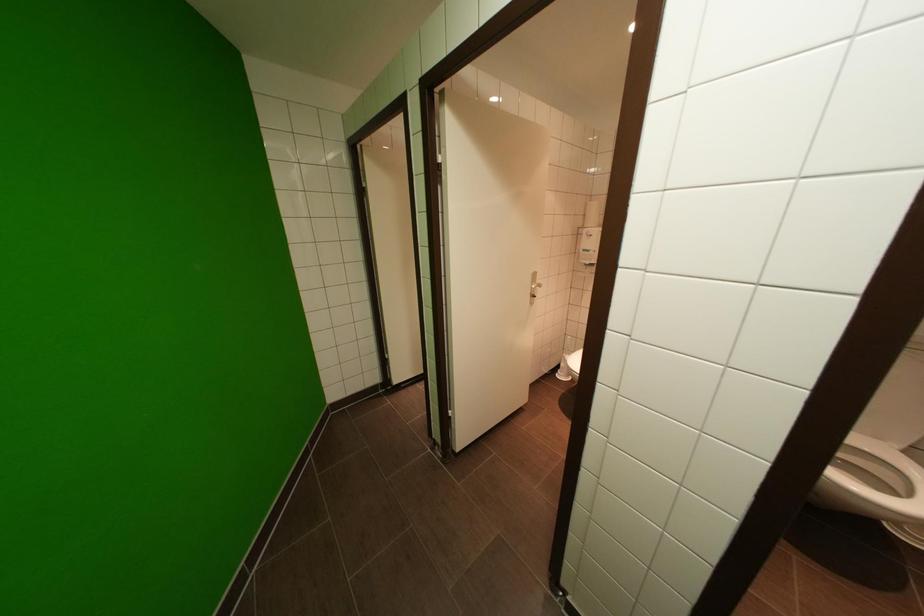
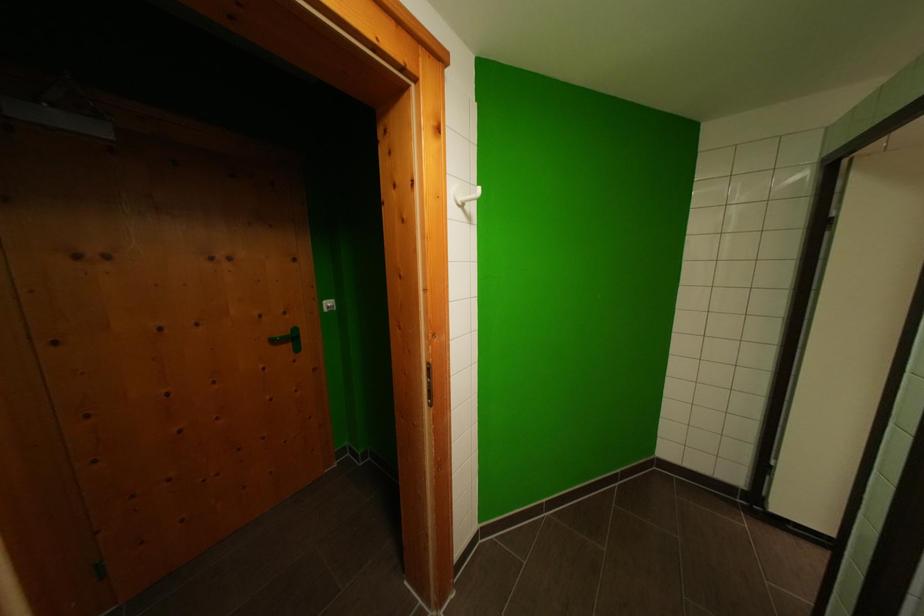
Question: The camera is either moving clockwise (left) or counter-clockwise (right) around the object. The first image is from the beginning of the video and the second image is from the end. Is the camera moving left or right when shooting the video?

Choices:
 (A) Left
 (B) Right

Answer: (B)